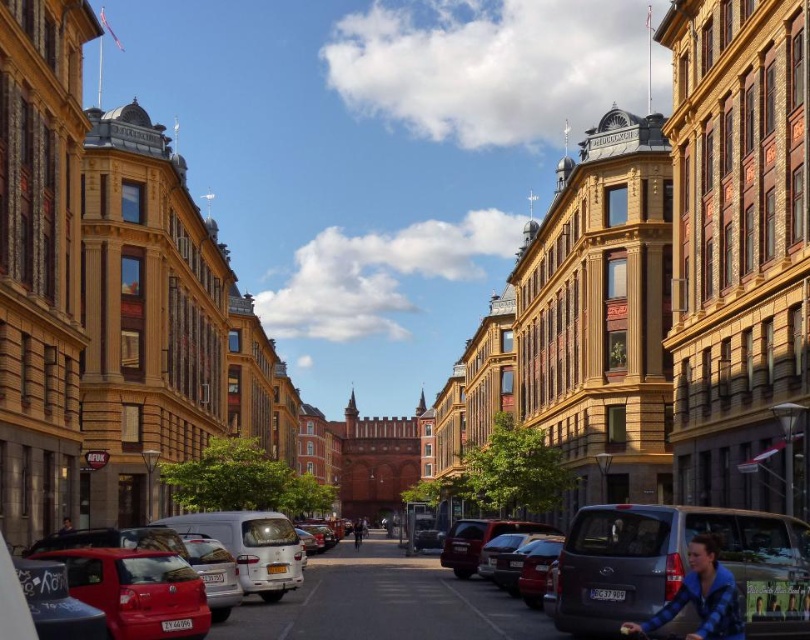
You are a delivery person trying to reach the dark blue fabric jacket at lower left, which is a customer waiting for a package. However, there is a matte gray van at lower right blocking the path. Can you still reach the customer without moving the van?

The matte gray van at lower right is positioned over dark blue fabric jacket at lower left, meaning the van is directly in front of the jacket. Therefore, you cannot reach the customer without moving the van.